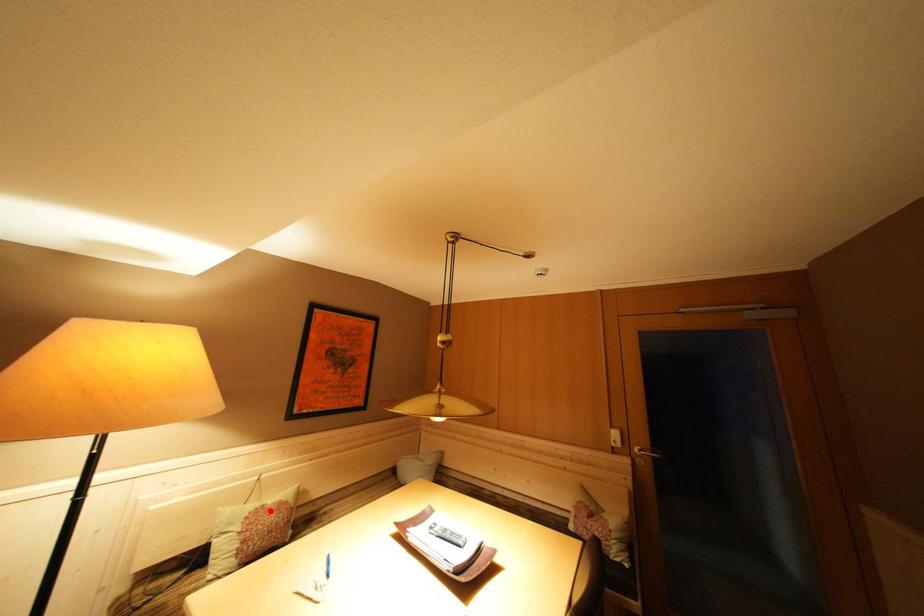
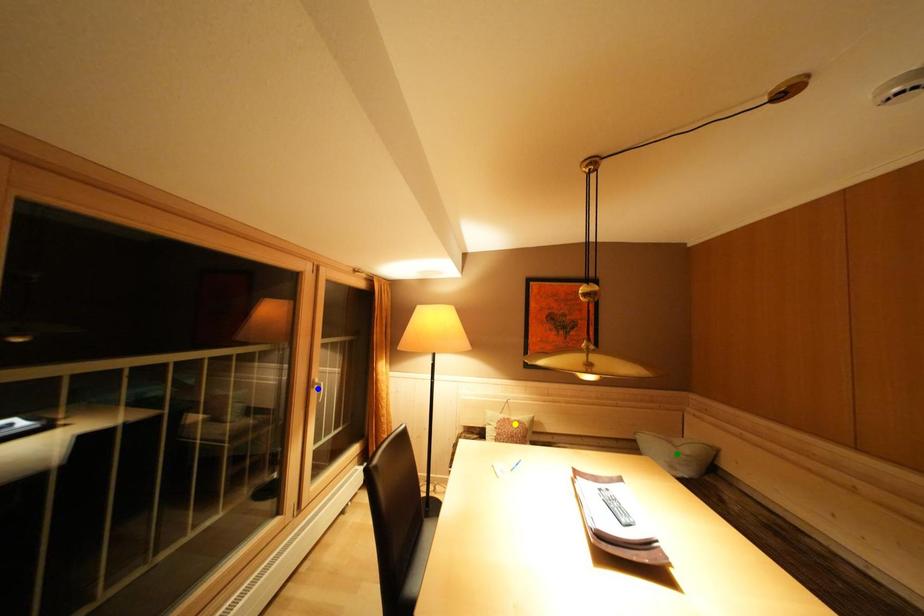
Question: I am providing you with two images of the same scene from different viewpoints. A red point is marked on the first image. You are given multiple points on the second image. Which spot in image 2 lines up with the point in image 1?

Choices:
 (A) green point
 (B) blue point
 (C) yellow point

Answer: (C)